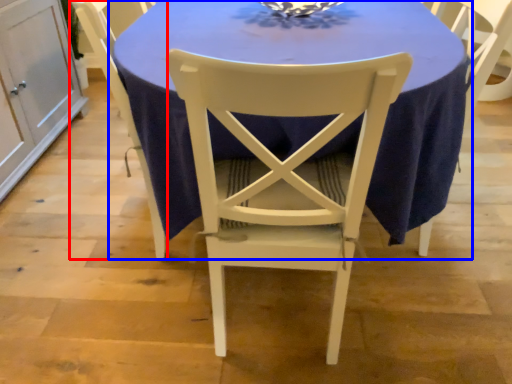
Question: Which object is closer to the camera taking this photo, chair (highlighted by a red box) or table (highlighted by a blue box)?

Choices:
 (A) chair
 (B) table

Answer: (B)